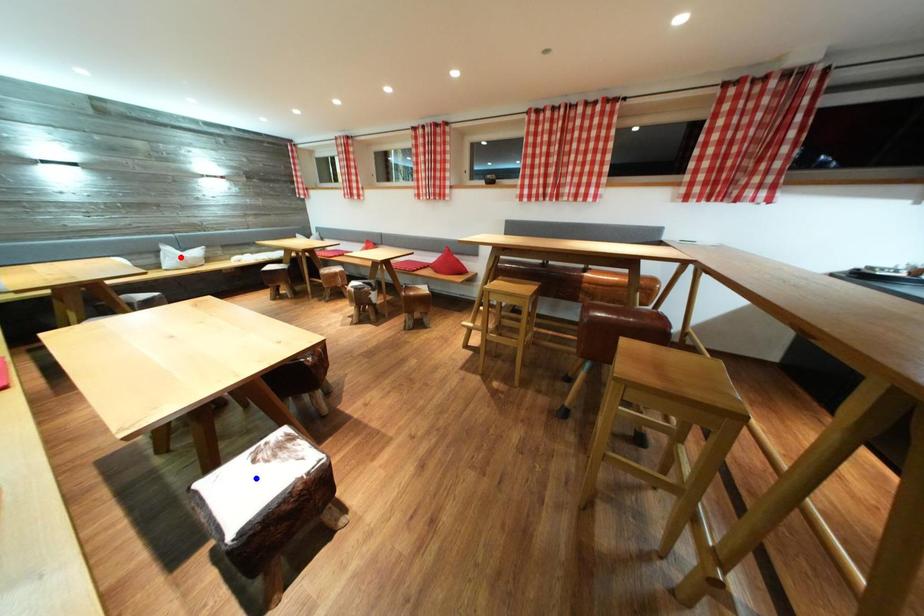
Question: In the image, two points are highlighted. Which point is nearer to the camera? Reply with the corresponding letter.

Choices:
 (A) blue point
 (B) red point

Answer: (A)